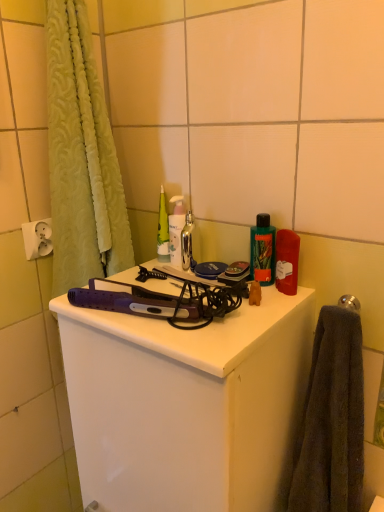
Question: Is polished silver towel bar at upper right positioned behind dark gray towel at right?

Choices:
 (A) yes
 (B) no

Answer: (A)

Question: From the image's perspective, does polished silver towel bar at upper right appear lower than dark gray towel at right?

Choices:
 (A) yes
 (B) no

Answer: (B)

Question: Does polished silver towel bar at upper right have a larger size compared to dark gray towel at right?

Choices:
 (A) yes
 (B) no

Answer: (B)

Question: Considering the relative sizes of polished silver towel bar at upper right and dark gray towel at right in the image provided, is polished silver towel bar at upper right wider than dark gray towel at right?

Choices:
 (A) no
 (B) yes

Answer: (A)

Question: Does polished silver towel bar at upper right have a lesser height compared to dark gray towel at right?

Choices:
 (A) no
 (B) yes

Answer: (B)

Question: From a real-world perspective, is metallic silver bottle at center, which is the second toiletry from right to left, above or below white plastic electric outlet at upper left?

Choices:
 (A) above
 (B) below

Answer: (A)

Question: In the image, is metallic silver bottle at center, the 1th toiletry in the left-to-right sequence, positioned in front of or behind white plastic electric outlet at upper left?

Choices:
 (A) behind
 (B) front

Answer: (A)

Question: From the image's perspective, is metallic silver bottle at center, which is the second toiletry from right to left, located above or below white plastic electric outlet at upper left?

Choices:
 (A) above
 (B) below

Answer: (A)

Question: In terms of size, does metallic silver bottle at center, which is the second toiletry from right to left, appear bigger or smaller than white plastic electric outlet at upper left?

Choices:
 (A) small
 (B) big

Answer: (B)

Question: Relative to metallic silver bottle at center, the 1th toiletry in the left-to-right sequence, is dark gray towel at right in front or behind?

Choices:
 (A) front
 (B) behind

Answer: (A)

Question: In terms of width, does dark gray towel at right look wider or thinner when compared to metallic silver bottle at center, arranged as the first toiletry when viewed from the back?

Choices:
 (A) thin
 (B) wide

Answer: (B)

Question: From a real-world perspective, is dark gray towel at right positioned above or below metallic silver bottle at center, the 1th toiletry in the left-to-right sequence?

Choices:
 (A) above
 (B) below

Answer: (B)

Question: Considering the relative positions of dark gray towel at right and metallic silver bottle at center, the 2th toiletry from the front, in the image provided, is dark gray towel at right to the left or to the right of metallic silver bottle at center, the 2th toiletry from the front,?

Choices:
 (A) left
 (B) right

Answer: (B)

Question: From the image's perspective, is dark gray towel at right above or below purple plastic hair straightener at center?

Choices:
 (A) below
 (B) above

Answer: (B)

Question: Is dark gray towel at right in front of or behind purple plastic hair straightener at center in the image?

Choices:
 (A) behind
 (B) front

Answer: (A)